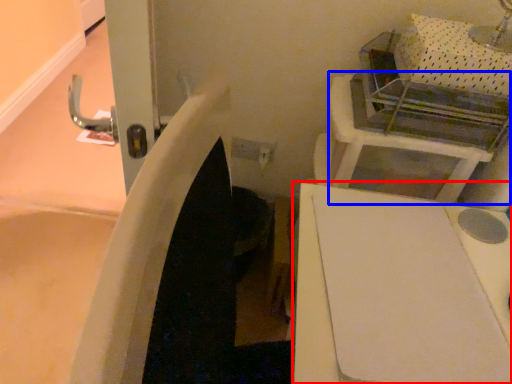
Question: Among these objects, which one is nearest to the camera, furniture (highlighted by a red box) or vanity (highlighted by a blue box)?

Choices:
 (A) furniture
 (B) vanity

Answer: (A)